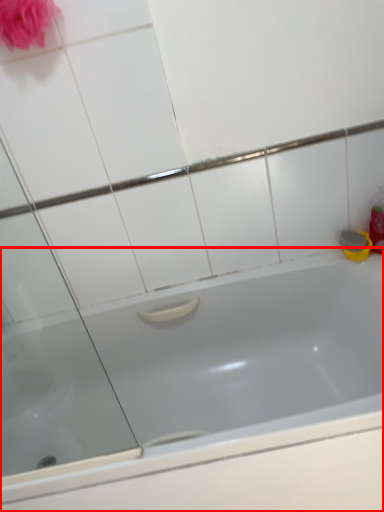
Question: In this image, where is bathtub (annotated by the red box) located relative to rose?

Choices:
 (A) left
 (B) right

Answer: (B)